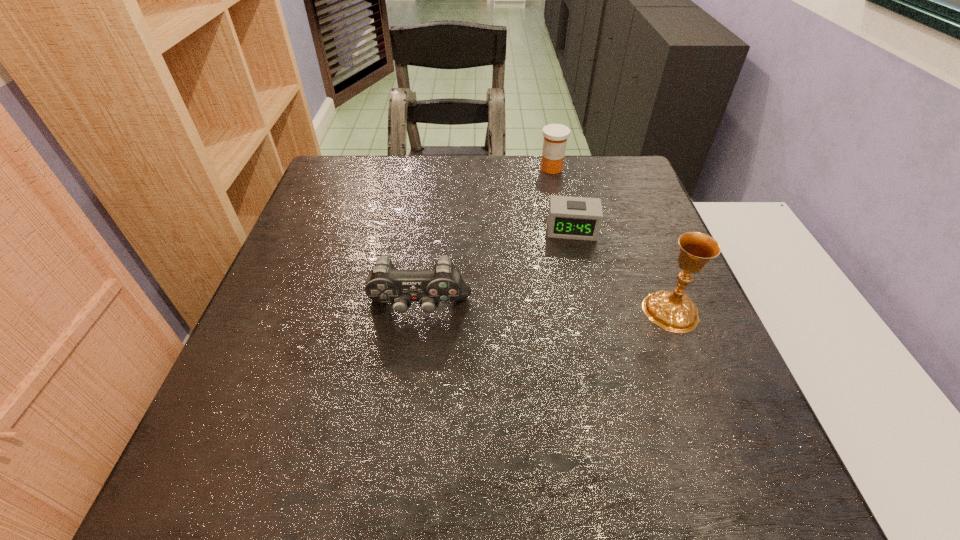
Identify the location of vacant space located 0.320m on the front-facing side of the shortest object. (577, 350).

The width and height of the screenshot is (960, 540). What are the coordinates of `free space located on the label of the medicine` in the screenshot? It's located at pyautogui.click(x=563, y=249).

The height and width of the screenshot is (540, 960). I want to click on vacant space located on the label of the medicine, so click(x=559, y=225).

The image size is (960, 540). Identify the location of vacant space located 0.260m on the label of the medicine. (560, 233).

Where is `object positioned at the far edge`? This screenshot has width=960, height=540. object positioned at the far edge is located at coordinates (555, 135).

This screenshot has width=960, height=540. What are the coordinates of `chalice present at the right edge` in the screenshot? It's located at (674, 311).

Image resolution: width=960 pixels, height=540 pixels. Identify the location of alarm clock positioned at the right edge. (579, 218).

Where is `vacant space at the far edge of the desktop`? The image size is (960, 540). vacant space at the far edge of the desktop is located at coordinates [450, 165].

Locate an element on the screen. This screenshot has height=540, width=960. vacant space at the left edge of the desktop is located at coordinates (310, 204).

In the image, there is a desktop. Identify the location of vacant area at the right edge. (640, 327).